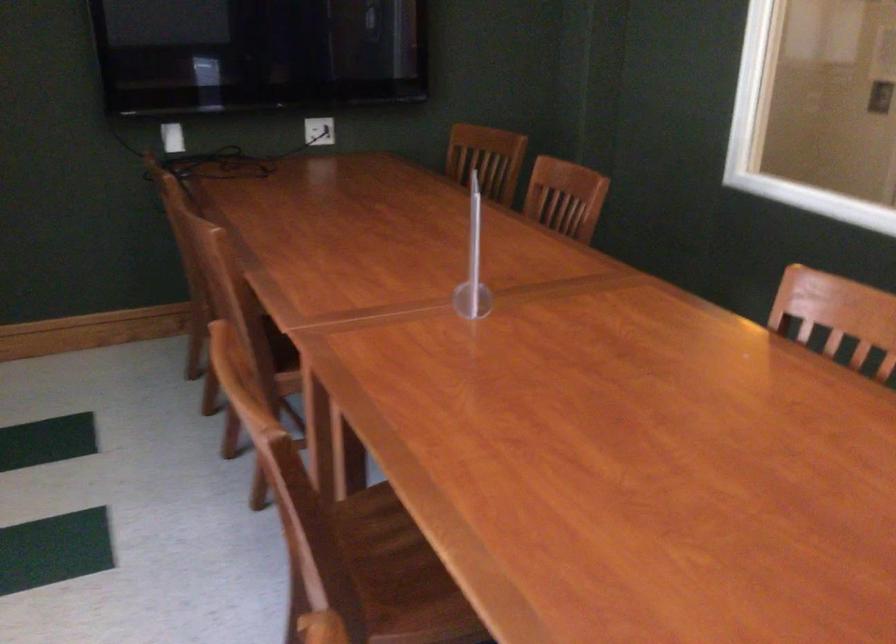
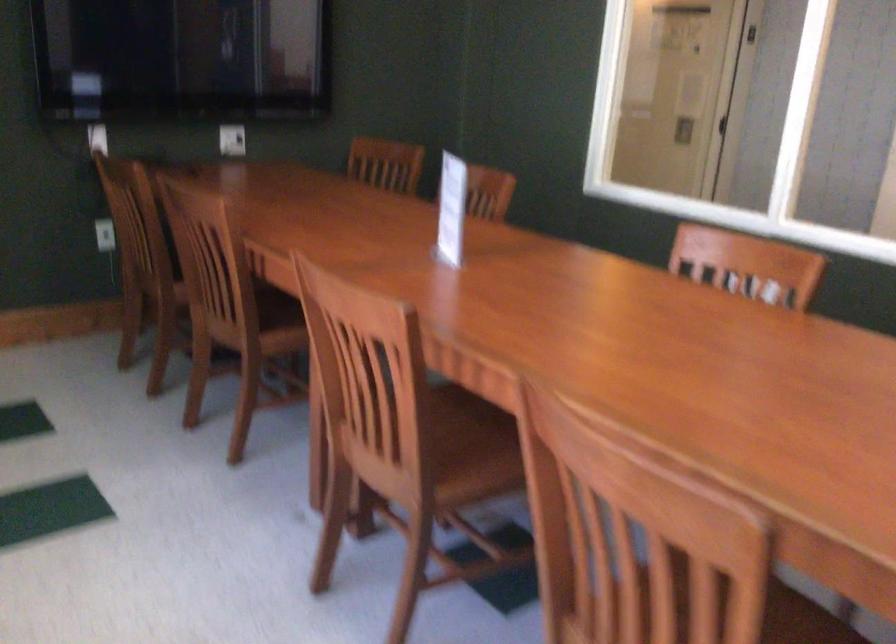
Question: How did the camera likely rotate?

Choices:
 (A) Left
 (B) Right
 (C) Up
 (D) Down

Answer: (B)